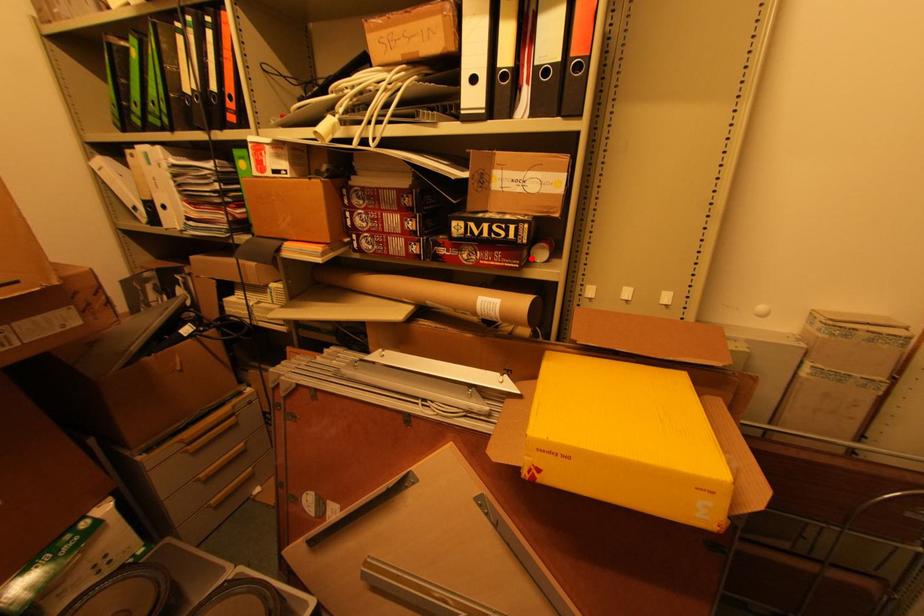
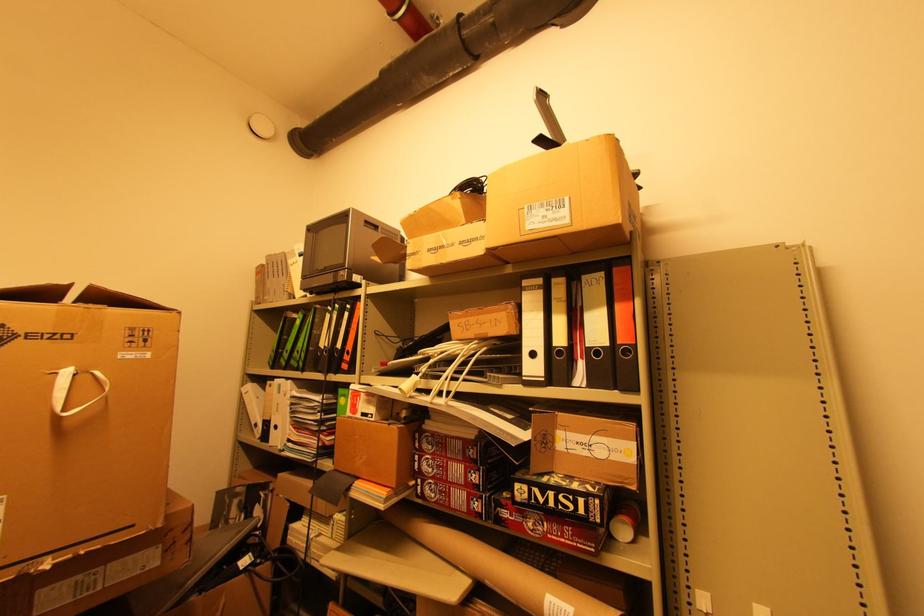
Where in the second image is the point corresponding to the highlighted location from the first image?

(611, 535)